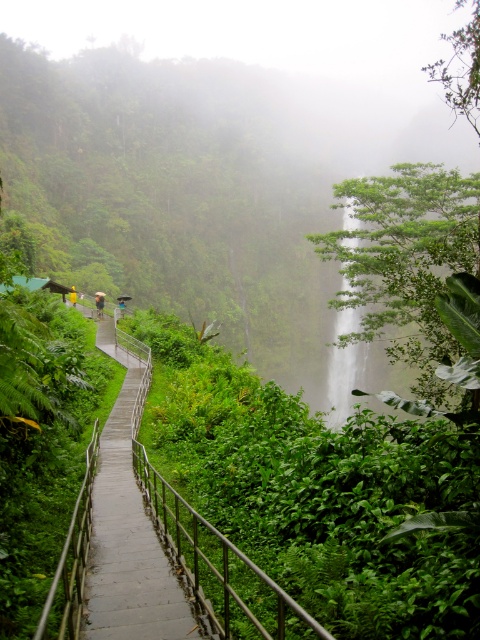
You are a hiker on the cliffside path and want to take a photo of the green leafy waterfall at center without the metallic silver rail at left appearing in the frame. How should you position yourself?

The metallic silver rail at left is located below the green leafy waterfall at center. To avoid the rail in your photo, position yourself above the rail so that the waterfall is framed above it.